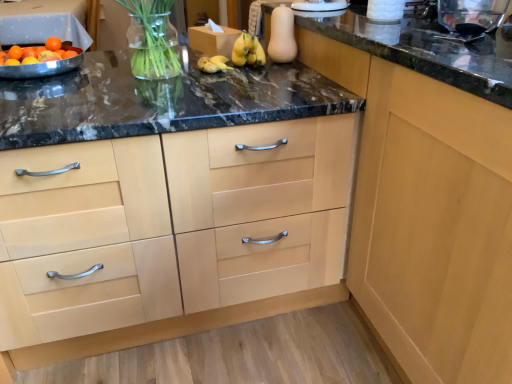
Question: From a real-world perspective, is orange matte at upper left under light wood cabinet at center, which is counted as the 1th cabinetry, starting from the right?

Choices:
 (A) no
 (B) yes

Answer: (A)

Question: Is orange matte at upper left shorter than light wood cabinet at center, which is counted as the 1th cabinetry, starting from the right?

Choices:
 (A) no
 (B) yes

Answer: (B)

Question: From a real-world perspective, is orange matte at upper left on top of light wood cabinet at center, the 2th cabinetry viewed from the left?

Choices:
 (A) no
 (B) yes

Answer: (B)

Question: Does orange matte at upper left lie in front of light wood cabinet at center, which is counted as the 1th cabinetry, starting from the right?

Choices:
 (A) no
 (B) yes

Answer: (A)

Question: From the image's perspective, is orange matte at upper left below light wood cabinet at center, the 2th cabinetry viewed from the left?

Choices:
 (A) yes
 (B) no

Answer: (B)

Question: Is light wood cabinet at center, positioned as the second cabinetry in right-to-left order, taller or shorter than orange matte at upper left?

Choices:
 (A) short
 (B) tall

Answer: (B)

Question: Do you think light wood cabinet at center, positioned as the second cabinetry in right-to-left order, is within orange matte at upper left, or outside of it?

Choices:
 (A) outside
 (B) inside

Answer: (A)

Question: Based on their sizes in the image, would you say light wood cabinet at center, positioned as the second cabinetry in right-to-left order, is bigger or smaller than orange matte at upper left?

Choices:
 (A) small
 (B) big

Answer: (B)

Question: Considering the positions of point (140, 145) and point (58, 41), is point (140, 145) closer or farther from the camera than point (58, 41)?

Choices:
 (A) closer
 (B) farther

Answer: (A)

Question: Is light wood cabinet at center, positioned as the second cabinetry in right-to-left order, spatially inside light wood cabinet at center, the 2th cabinetry viewed from the left, or outside of it?

Choices:
 (A) outside
 (B) inside

Answer: (A)

Question: Relative to light wood cabinet at center, the 2th cabinetry viewed from the left, is light wood cabinet at center, positioned as the second cabinetry in right-to-left order, in front or behind?

Choices:
 (A) behind
 (B) front

Answer: (A)

Question: From a real-world perspective, relative to light wood cabinet at center, the 2th cabinetry viewed from the left, is light wood cabinet at center, positioned as the second cabinetry in right-to-left order, vertically above or below?

Choices:
 (A) below
 (B) above

Answer: (A)

Question: In terms of height, does light wood cabinet at center, positioned as the second cabinetry in right-to-left order, look taller or shorter compared to light wood cabinet at center, the 2th cabinetry viewed from the left?

Choices:
 (A) tall
 (B) short

Answer: (B)

Question: Based on their sizes in the image, would you say light wood cabinet at center, the 2th cabinetry viewed from the left, is bigger or smaller than light wood cabinet at center, positioned as the second cabinetry in right-to-left order?

Choices:
 (A) small
 (B) big

Answer: (B)

Question: Relative to light wood cabinet at center, positioned as the second cabinetry in right-to-left order, is light wood cabinet at center, the 2th cabinetry viewed from the left, in front or behind?

Choices:
 (A) front
 (B) behind

Answer: (A)